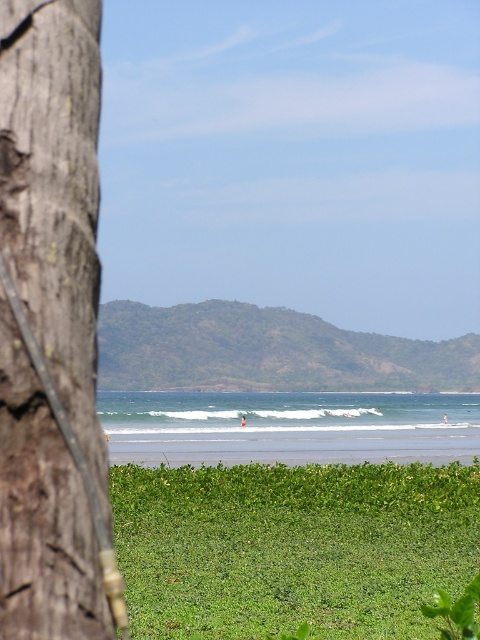
You are standing in the coastal scene and want to take a photo of the brown rough tree trunk at left and the green leafy grass at lower center. Which object will appear larger in your photo?

The brown rough tree trunk at left will appear larger in the photo because it is closer to the viewer than the green leafy grass at lower center.

You are standing in the coastal scene and see the point marked at coordinates (55, 196). Which object from the scene does this point lie on?

The point marked at coordinates (55, 196) lies on the brown rough tree trunk at left.

You are a gardener standing in the coastal area shown. You need to place a small decorative stone between the brown rough tree trunk at left and the green leafy grass at lower center. Based on their positions, where should you place it?

The brown rough tree trunk at left is above the green leafy grass at lower center, so you should place the stone between them either below the tree trunk and above the grass or adjust placement according to their vertical alignment.